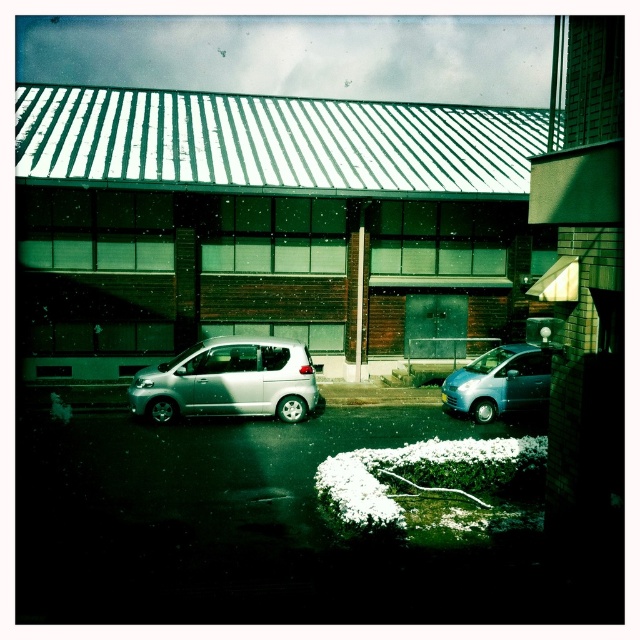
Question: Is the position of satin silver car at center less distant than that of satin silver van at center?

Choices:
 (A) no
 (B) yes

Answer: (B)

Question: Which of the following is the farthest from the observer?

Choices:
 (A) (512, 404)
 (B) (179, 410)

Answer: (A)

Question: Can you confirm if satin silver car at center is bigger than satin silver van at center?

Choices:
 (A) yes
 (B) no

Answer: (A)

Question: Does satin silver car at center appear under satin silver van at center?

Choices:
 (A) no
 (B) yes

Answer: (A)